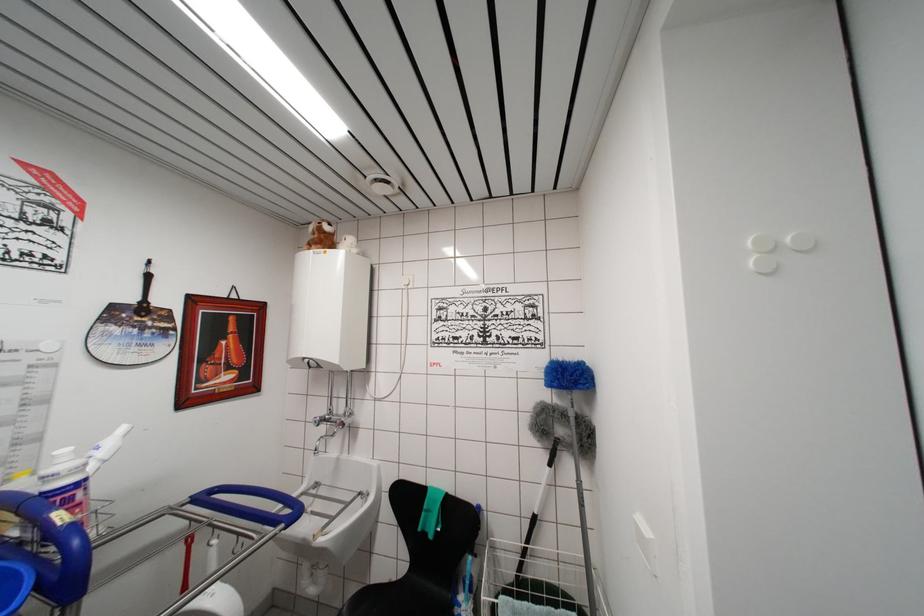
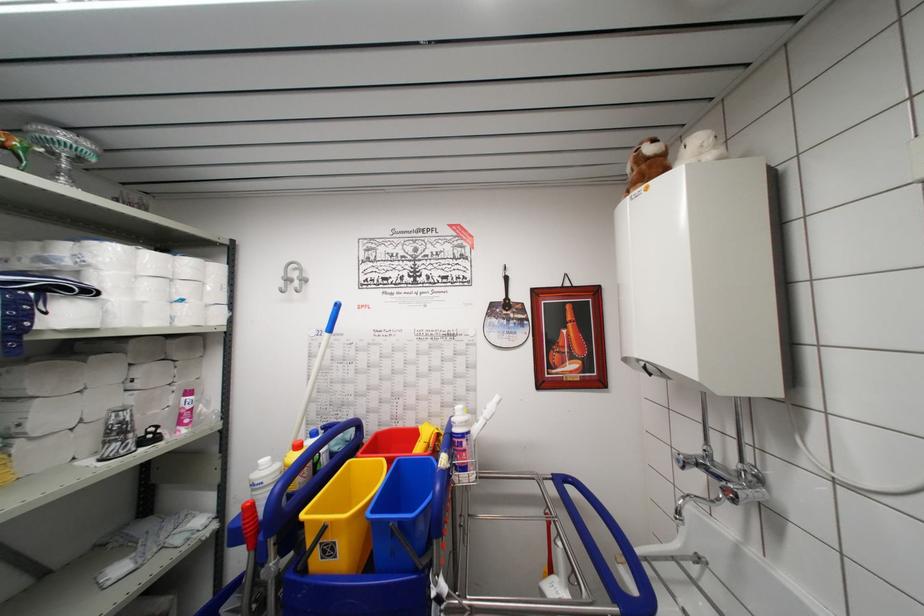
Where in the second image is the point corresponding to [191,511] from the first image?

(554, 487)